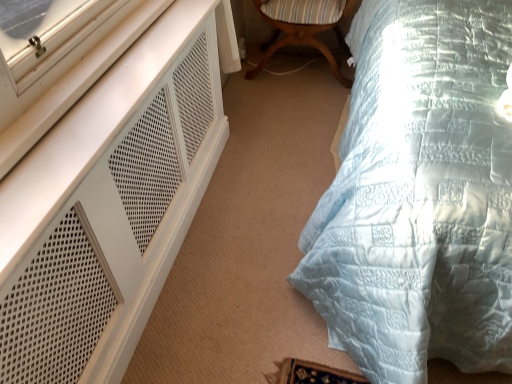
Question: Could you tell me if white mesh dresser at left is turned towards wooden striped cushion at center?

Choices:
 (A) no
 (B) yes

Answer: (A)

Question: From the image's perspective, is white mesh dresser at left beneath wooden striped cushion at center?

Choices:
 (A) yes
 (B) no

Answer: (A)

Question: Is white mesh dresser at left in contact with wooden striped cushion at center?

Choices:
 (A) no
 (B) yes

Answer: (A)

Question: Can you confirm if white mesh dresser at left is shorter than wooden striped cushion at center?

Choices:
 (A) no
 (B) yes

Answer: (A)

Question: Is white mesh dresser at left smaller than wooden striped cushion at center?

Choices:
 (A) yes
 (B) no

Answer: (B)

Question: Does white mesh dresser at left appear on the left side of wooden striped cushion at center?

Choices:
 (A) no
 (B) yes

Answer: (B)

Question: Considering the relative positions of light blue quilted bed at right and wooden striped cushion at center in the image provided, is light blue quilted bed at right to the right of wooden striped cushion at center from the viewer's perspective?

Choices:
 (A) yes
 (B) no

Answer: (A)

Question: Is light blue quilted bed at right at the left side of wooden striped cushion at center?

Choices:
 (A) yes
 (B) no

Answer: (B)

Question: Considering the relative sizes of light blue quilted bed at right and wooden striped cushion at center in the image provided, is light blue quilted bed at right bigger than wooden striped cushion at center?

Choices:
 (A) no
 (B) yes

Answer: (B)

Question: Is wooden striped cushion at center inside light blue quilted bed at right?

Choices:
 (A) no
 (B) yes

Answer: (A)

Question: From a real-world perspective, is light blue quilted bed at right located higher than wooden striped cushion at center?

Choices:
 (A) yes
 (B) no

Answer: (A)

Question: Is light blue quilted bed at right shorter than wooden striped cushion at center?

Choices:
 (A) no
 (B) yes

Answer: (A)

Question: Can you confirm if light blue quilted bed at right is positioned to the left of white mesh dresser at left?

Choices:
 (A) yes
 (B) no

Answer: (B)